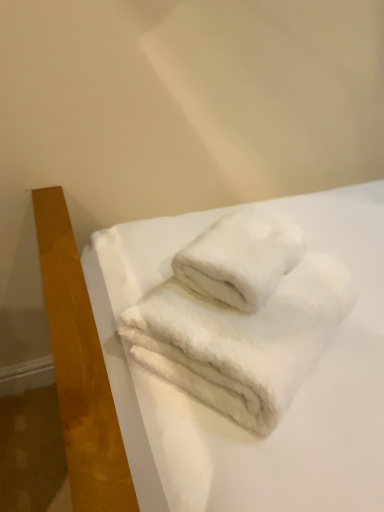
Question: Would you consider white fluffy sheet at center to be distant from white fluffy towel at center?

Choices:
 (A) no
 (B) yes

Answer: (A)

Question: Are white fluffy sheet at center and white fluffy towel at center making contact?

Choices:
 (A) yes
 (B) no

Answer: (B)

Question: Is white fluffy sheet at center smaller than white fluffy towel at center?

Choices:
 (A) no
 (B) yes

Answer: (A)

Question: Is white fluffy sheet at center bigger than white fluffy towel at center?

Choices:
 (A) no
 (B) yes

Answer: (B)

Question: From a real-world perspective, is white fluffy sheet at center below white fluffy towel at center?

Choices:
 (A) yes
 (B) no

Answer: (A)

Question: From the image's perspective, is white fluffy sheet at center located beneath white fluffy towel at center?

Choices:
 (A) yes
 (B) no

Answer: (A)

Question: Is white fluffy towel at center wider than white fluffy sheet at center?

Choices:
 (A) yes
 (B) no

Answer: (B)

Question: Could you tell me if white fluffy towel at center is turned towards white fluffy sheet at center?

Choices:
 (A) no
 (B) yes

Answer: (B)

Question: Is white fluffy towel at center outside white fluffy sheet at center?

Choices:
 (A) yes
 (B) no

Answer: (B)

Question: Can you confirm if white fluffy towel at center is shorter than white fluffy sheet at center?

Choices:
 (A) yes
 (B) no

Answer: (A)

Question: Is white fluffy towel at center to the right of white fluffy sheet at center from the viewer's perspective?

Choices:
 (A) yes
 (B) no

Answer: (B)

Question: From a real-world perspective, is white fluffy towel at center on white fluffy sheet at center?

Choices:
 (A) yes
 (B) no

Answer: (A)

Question: From the image's perspective, is white fluffy sheet at center positioned above or below white fluffy towel at center?

Choices:
 (A) above
 (B) below

Answer: (B)